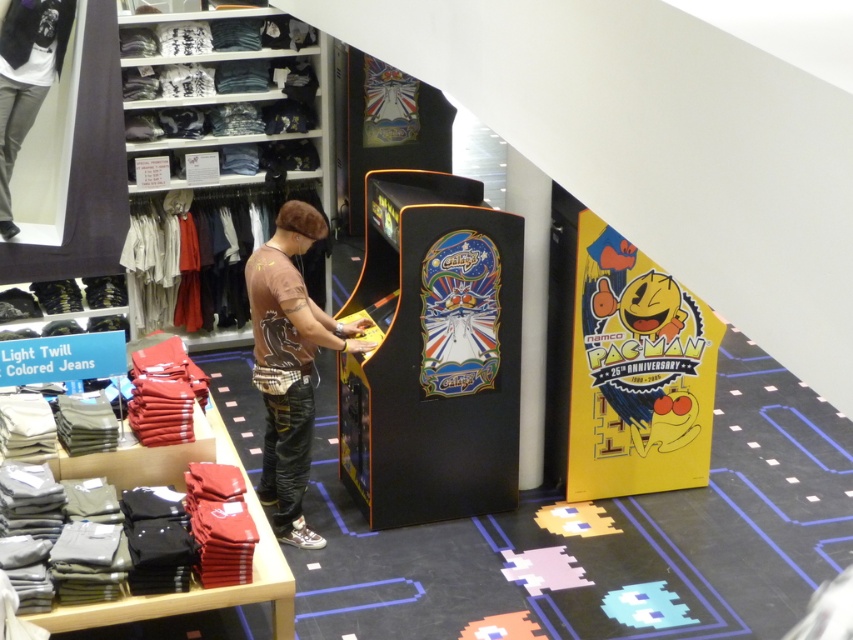
Question: Is shiny black arcade machine at center to the right of light gray jeans at center from the viewer's perspective?

Choices:
 (A) no
 (B) yes

Answer: (B)

Question: Does shiny black arcade machine at center appear under light gray jeans at center?

Choices:
 (A) no
 (B) yes

Answer: (B)

Question: Does shiny black arcade machine at center appear over brown cotton t-shirt at center?

Choices:
 (A) yes
 (B) no

Answer: (A)

Question: Estimate the real-world distances between objects in this image. Which object is farther from the light gray jeans at center?

Choices:
 (A) brown cotton t-shirt at center
 (B) shiny black arcade machine at center

Answer: (B)

Question: Which object is the closest to the brown cotton t-shirt at center?

Choices:
 (A) shiny black arcade machine at center
 (B) light gray jeans at center

Answer: (A)

Question: Which object appears closest to the camera in this image?

Choices:
 (A) light gray jeans at center
 (B) brown cotton t-shirt at center

Answer: (B)